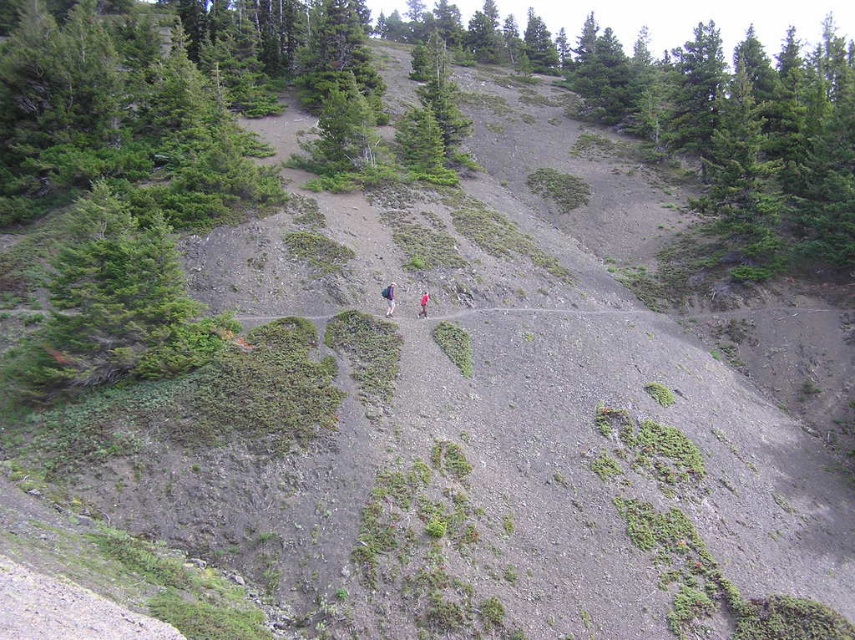
Is green textured shrub at left to the left of pink fabric at center from the viewer's perspective?

Yes, green textured shrub at left is to the left of pink fabric at center.

Between green textured shrub at left and pink fabric at center, which one is positioned higher?

green textured shrub at left is above.

Is point (122, 330) less distant than point (428, 301)?

Yes, point (122, 330) is closer to viewer.

Identify the location of green textured shrub at left. (115, 305).

Does green textured shrub at left have a smaller size compared to purple fabric backpack at center?

Actually, green textured shrub at left might be larger than purple fabric backpack at center.

Who is more forward, (40, 369) or (393, 308)?

Positioned in front is point (40, 369).

Is point (105, 314) positioned in front of point (388, 291)?

That is True.

You are a GUI agent. You are given a task and a screenshot of the screen. Output one action in this format:
    pyautogui.click(x=<x>, y=<y>)
    Task: Click on the green textured shrub at left
    
    Given the screenshot: What is the action you would take?
    pyautogui.click(x=115, y=305)

Is point (392, 284) less distant than point (428, 301)?

No.

Does purple fabric backpack at center have a greater height compared to pink fabric at center?

Indeed, purple fabric backpack at center has a greater height compared to pink fabric at center.

Image resolution: width=855 pixels, height=640 pixels. What are the coordinates of `purple fabric backpack at center` in the screenshot? It's located at (388, 298).

Find the location of a particular element. The image size is (855, 640). purple fabric backpack at center is located at coordinates (388, 298).